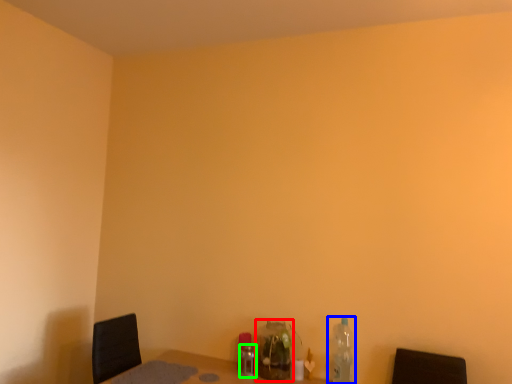
Question: Based on their relative distances, which object is farther from bottle (highlighted by a red box)? Choose from bottle (highlighted by a blue box) and bottle (highlighted by a green box).

Choices:
 (A) bottle
 (B) bottle

Answer: (A)